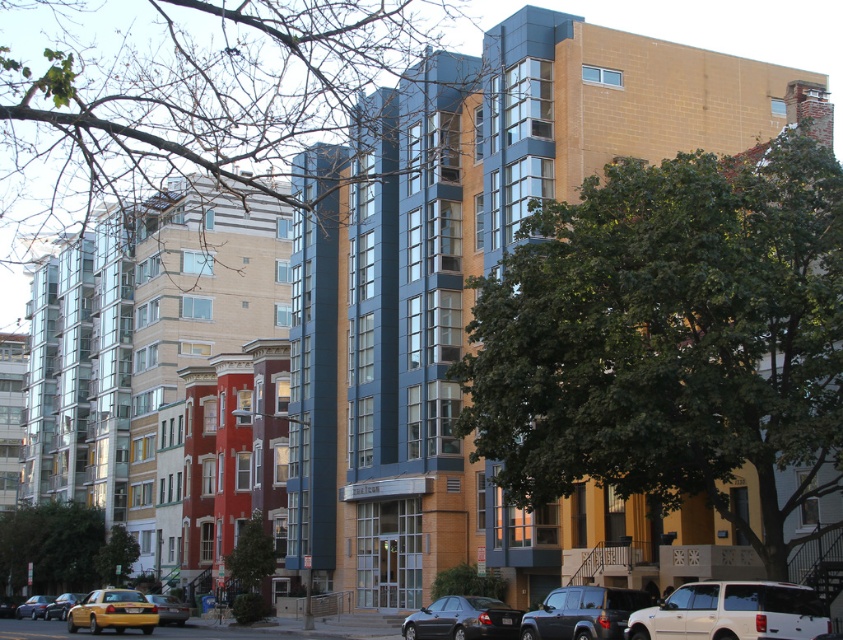
Is shiny black sedan at lower center above yellow metallic taxi cab at lower left?

Indeed, shiny black sedan at lower center is positioned over yellow metallic taxi cab at lower left.

Does shiny black sedan at lower center have a greater width compared to yellow metallic taxi cab at lower left?

In fact, shiny black sedan at lower center might be narrower than yellow metallic taxi cab at lower left.

Which is behind, point (465, 600) or point (62, 595)?

The point (62, 595) is more distant.

Locate an element on the screen. This screenshot has width=843, height=640. shiny black sedan at lower center is located at coordinates pyautogui.click(x=463, y=620).

Who is lower down, white matte suv at lower right or shiny black sedan at lower center?

shiny black sedan at lower center is below.

Is white matte suv at lower right shorter than shiny black sedan at lower center?

Yes.

Who is more forward, (706,595) or (503,604)?

Point (706,595) is in front.

Identify the location of white matte suv at lower right. (733, 612).

Is matte gray suv at lower center taller than yellow metallic taxi cab at lower left?

In fact, matte gray suv at lower center may be shorter than yellow metallic taxi cab at lower left.

Who is positioned more to the right, matte gray suv at lower center or yellow metallic taxi cab at lower left?

Positioned to the right is matte gray suv at lower center.

Is point (549, 602) farther from camera compared to point (57, 604)?

No, it is in front of (57, 604).

The image size is (843, 640). In order to click on matte gray suv at lower center in this screenshot , I will do `click(583, 612)`.